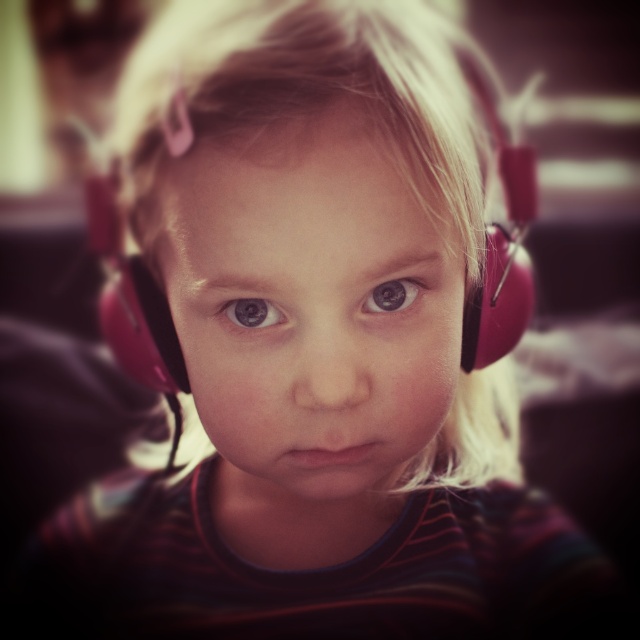
Question: Does blue matte eye at center come in front of brown matte eye at center?

Choices:
 (A) no
 (B) yes

Answer: (B)

Question: Which object is closer to the camera taking this photo?

Choices:
 (A) brown matte eye at center
 (B) blue matte eye at center

Answer: (B)

Question: Does blue matte eye at center have a greater width compared to brown matte eye at center?

Choices:
 (A) no
 (B) yes

Answer: (B)

Question: Is blue matte eye at center below brown matte eye at center?

Choices:
 (A) no
 (B) yes

Answer: (B)

Question: Which point is farther to the camera?

Choices:
 (A) coord(378,285)
 (B) coord(237,312)

Answer: (B)